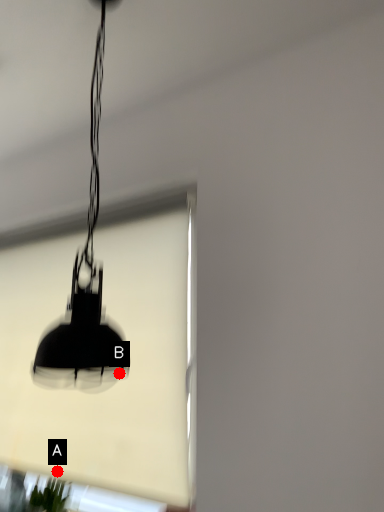
Question: Two points are circled on the image, labeled by A and B beside each circle. Which point appears closest to the camera in this image?

Choices:
 (A) A is closer
 (B) B is closer

Answer: (B)